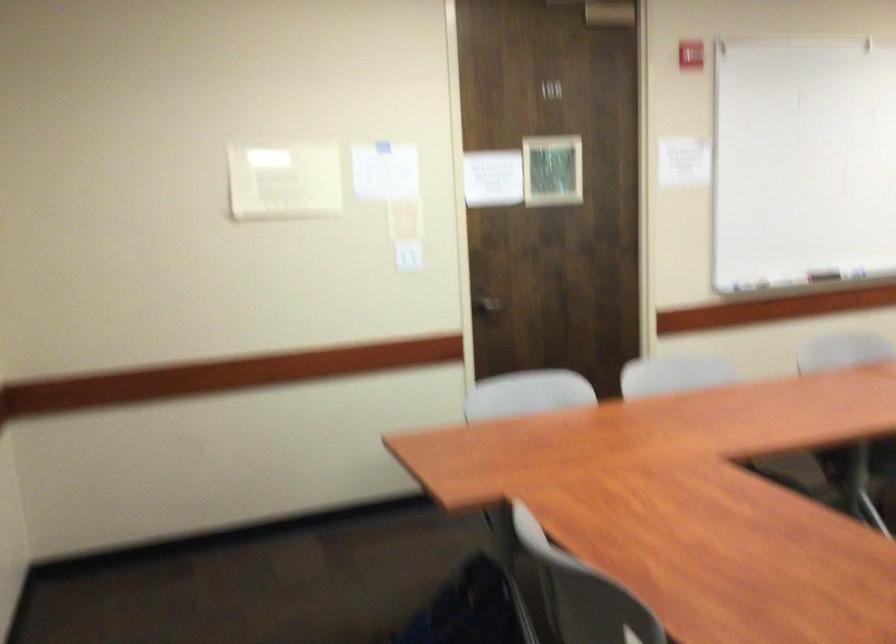
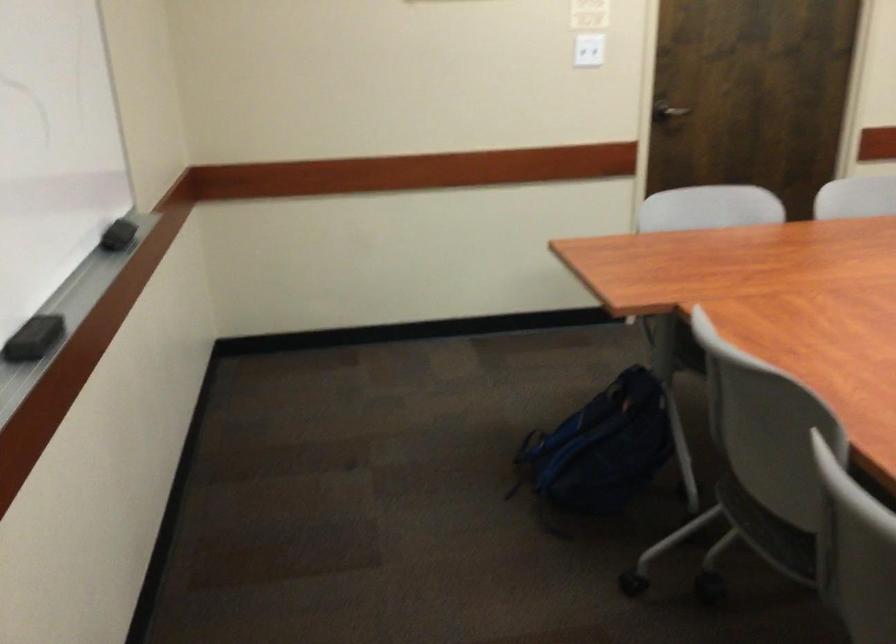
In the second image, find the point that corresponds to (483,307) in the first image.

(667, 111)